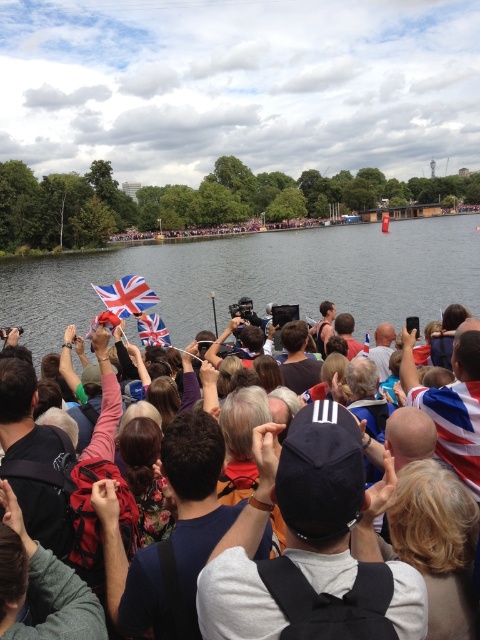
Looking at this image, between british flag fabric at center and union jack fabric flag at center, which one appears on the left side from the viewer's perspective?

union jack fabric flag at center

Which is behind, point (385, 476) or point (146, 292)?

The point (146, 292) is behind.

You are a GUI agent. You are given a task and a screenshot of the screen. Output one action in this format:
    pyautogui.click(x=<x>, y=<y>)
    Task: Click on the british flag fabric at center
    The width and height of the screenshot is (480, 640).
    Given the screenshot: What is the action you would take?
    pyautogui.click(x=254, y=493)

Between point (476, 387) and point (106, 285), which one is positioned behind?

Point (106, 285)

The height and width of the screenshot is (640, 480). I want to click on striped fabric flag at center, so click(x=454, y=426).

Does clear water at center appear on the left side of union jack fabric flag at center?

In fact, clear water at center is to the right of union jack fabric flag at center.

Measure the distance between point (232, 264) and camera.

The distance of point (232, 264) from camera is 100.52 meters.

Locate an element on the screen. This screenshot has width=480, height=640. clear water at center is located at coordinates (259, 276).